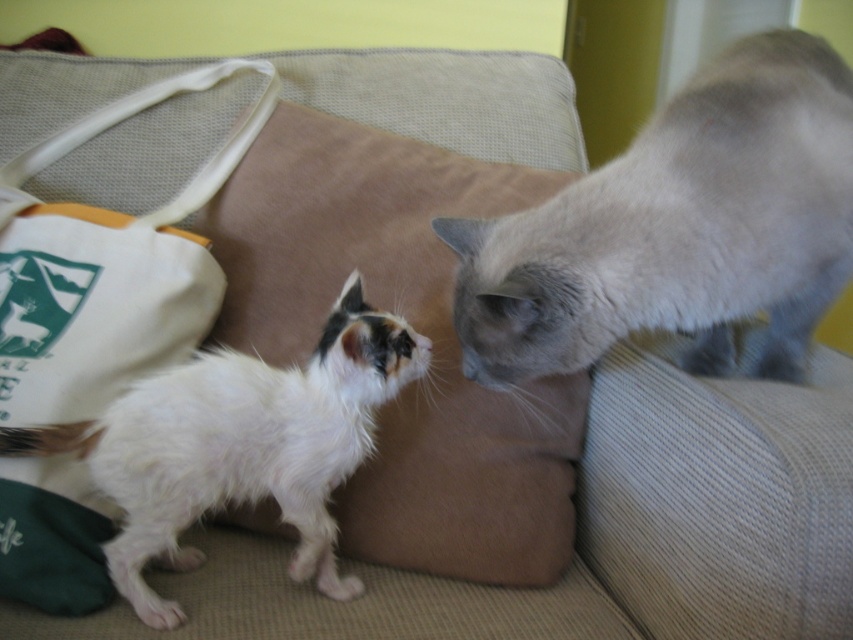
In the scene shown: You are organizing the items on the couch and need to place the beige fabric pillow at center and the white canvas bag at left. Given their sizes, which item should you move first to ensure proper arrangement?

The beige fabric pillow at center is smaller than the white canvas bag at left, so you should move the white canvas bag at left first because it takes up more space and needs to be positioned carefully to accommodate the smaller pillow.

You are a cat owner who wants to place a new toy exactly where the beige fabric pillow at center is located. According to the coordinates provided, what are the coordinates where you should place the toy?

The coordinates for the beige fabric pillow at center are at point (415, 328). Therefore, you should place the toy at coordinates (415, 328).

There are two cats on the couch. The first cat is at point (244,250). The second cat is at point 0.609, 0.713. How far apart are the two cats?

The two cats are 3.57 feet apart.